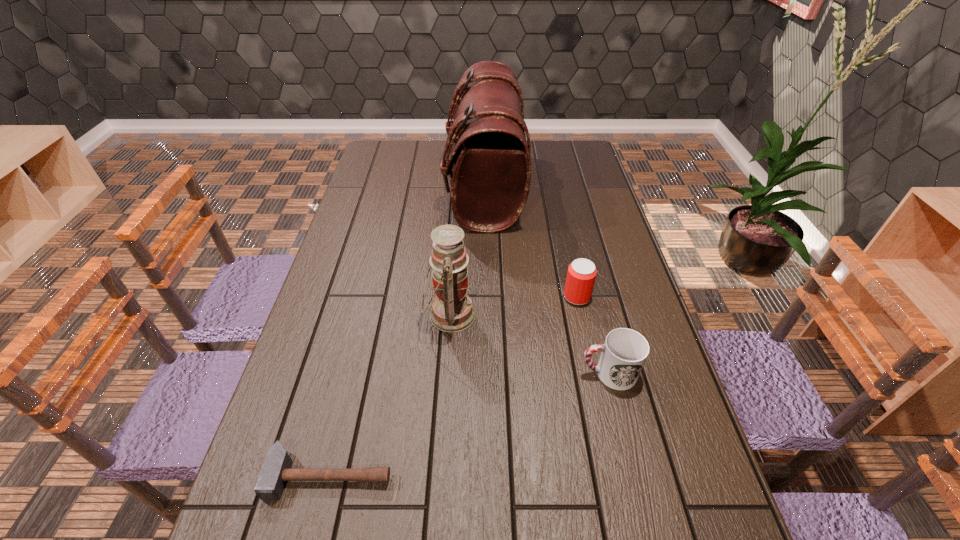
The height and width of the screenshot is (540, 960). I want to click on satchel, so click(491, 160).

This screenshot has width=960, height=540. In order to click on the farthest object in this screenshot , I will do `click(491, 160)`.

Where is `the fourth shortest object`? This screenshot has height=540, width=960. the fourth shortest object is located at coordinates (452, 311).

The width and height of the screenshot is (960, 540). In order to click on beer can in this screenshot , I will do `click(581, 275)`.

The width and height of the screenshot is (960, 540). Find the location of `cup`. cup is located at coordinates (624, 352).

Image resolution: width=960 pixels, height=540 pixels. I want to click on the shortest object, so click(x=275, y=471).

The width and height of the screenshot is (960, 540). Find the location of `the leftmost object`. the leftmost object is located at coordinates (275, 471).

The height and width of the screenshot is (540, 960). In order to click on vacant space located 0.120m on the front-facing side of the farthest object in this screenshot , I will do `click(414, 189)`.

You are a GUI agent. You are given a task and a screenshot of the screen. Output one action in this format:
    pyautogui.click(x=<x>, y=<y>)
    Task: Click on the free space located on the front-facing side of the farthest object
    This screenshot has height=540, width=960.
    Given the screenshot: What is the action you would take?
    pyautogui.click(x=379, y=189)

At what (x,y) coordinates should I click in order to perform the action: click on free spot located on the front-facing side of the farthest object. Please return your answer as a coordinate pair (x, y). Looking at the image, I should click on (373, 189).